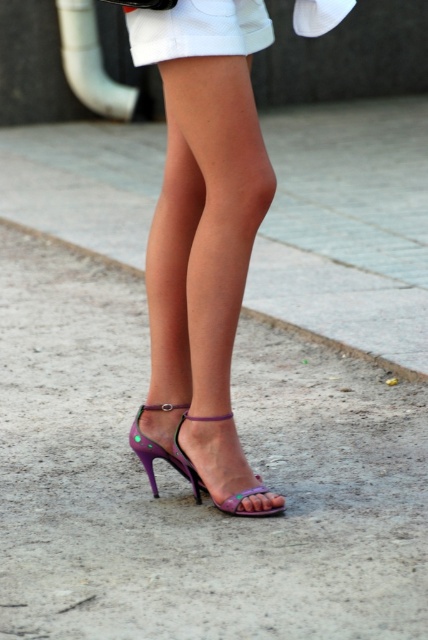
Question: Estimate the real-world distances between objects in this image. Which object is closer to the purple shiny high-heeled sandal at lower center?

Choices:
 (A) purple shiny sandal at lower center
 (B) white cotton shorts at center
 (C) purple shiny high-heeled sandals at lower center

Answer: (A)

Question: Can you confirm if purple shiny high-heeled sandals at lower center is wider than purple shiny high-heeled sandal at lower center?

Choices:
 (A) yes
 (B) no

Answer: (A)

Question: Can you confirm if purple shiny high-heeled sandals at lower center is thinner than white cotton shorts at center?

Choices:
 (A) yes
 (B) no

Answer: (B)

Question: Can you confirm if purple shiny high-heeled sandals at lower center is positioned above purple shiny high-heeled sandal at lower center?

Choices:
 (A) no
 (B) yes

Answer: (B)

Question: Among these points, which one is nearest to the camera?

Choices:
 (A) (234, 502)
 (B) (240, 189)

Answer: (B)

Question: Based on their relative distances, which object is nearer to the white cotton shorts at center?

Choices:
 (A) purple shiny sandal at lower center
 (B) purple shiny high-heeled sandal at lower center
 (C) purple shiny high-heeled sandals at lower center

Answer: (C)